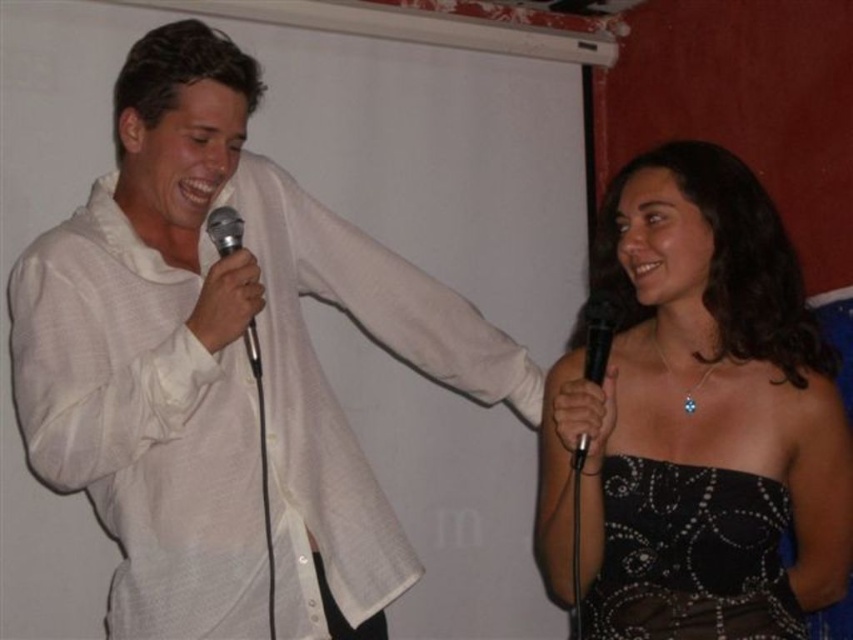
You are an event organizer setting up a stage for a duet performance. You need to position two microphones so they are visible to the audience. Based on the image, is the metallic silver microphone at left placed higher than the black satin dress at right?

The black satin dress at right is below the metallic silver microphone at left, so yes, the metallic silver microphone at left is placed higher than the black satin dress at right.

You are organizing a stage setup for a performance. The stage has a narrow platform that can only accommodate items up to 30 cm in width. You need to place both the black satin dress at right and the metallic silver microphone at left on this platform. Based on their sizes, will both items fit on the platform?

The black satin dress at right is wider than the metallic silver microphone at left. Since the platform can only hold items up to 30 cm, both items will fit as long as the dress is within the 30 cm width limit. However, if the dress exceeds 30 cm, it won

You are a stage manager preparing for a performance. You need to position two performers wearing the black satin dress at right and the black sequined dress at lower right. Based on their heights, which performer should stand in the front row to ensure visibility?

The black sequined dress at lower right should stand in the front row because it is shorter than the black satin dress at right, allowing the taller performer to be seen over the shorter one.